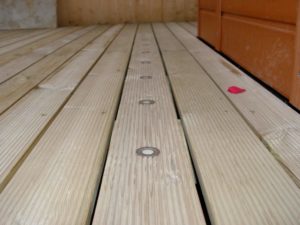
This screenshot has height=225, width=300. I want to click on bottom of brick colored counter, so click(258, 37).